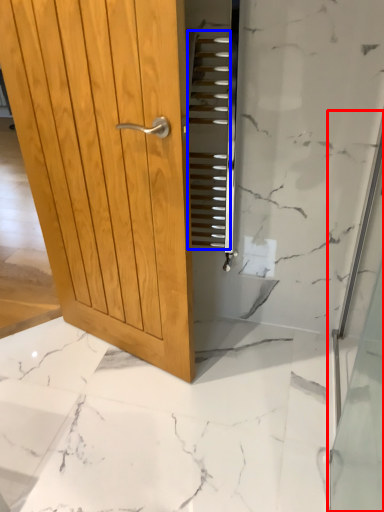
Question: Among these objects, which one is farthest to the camera, shower door (highlighted by a red box) or stair (highlighted by a blue box)?

Choices:
 (A) shower door
 (B) stair

Answer: (B)